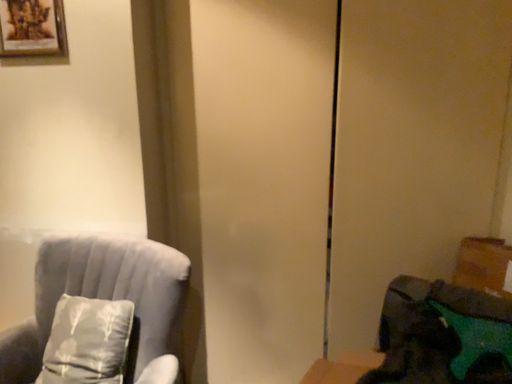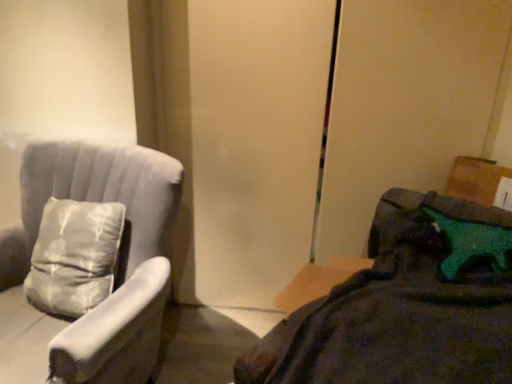
Question: Which way did the camera rotate in the video?

Choices:
 (A) rotated downward
 (B) rotated upward

Answer: (A)